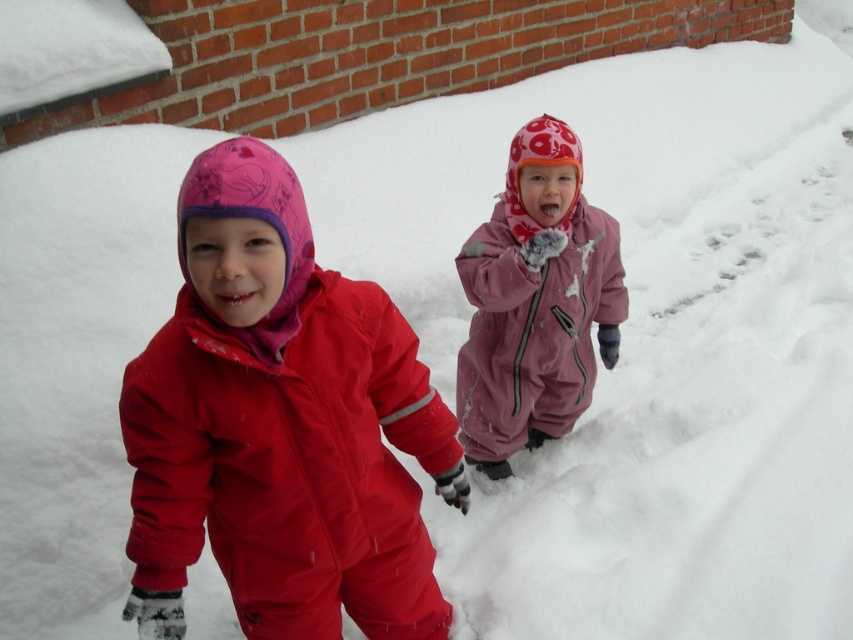
Question: Is matte red snowsuit at left to the left of matte pink snowsuit at center from the viewer's perspective?

Choices:
 (A) yes
 (B) no

Answer: (A)

Question: Which point is closer to the camera?

Choices:
 (A) matte red snowsuit at left
 (B) matte pink snowsuit at center

Answer: (A)

Question: Can you confirm if matte red snowsuit at left is positioned below matte pink snowsuit at center?

Choices:
 (A) yes
 (B) no

Answer: (A)

Question: Is the position of matte red snowsuit at left more distant than that of matte pink snowsuit at center?

Choices:
 (A) no
 (B) yes

Answer: (A)

Question: Among these points, which one is farthest from the camera?

Choices:
 (A) (602, 348)
 (B) (422, 522)

Answer: (A)

Question: Which point is farther to the camera?

Choices:
 (A) (505, 282)
 (B) (358, 304)

Answer: (A)